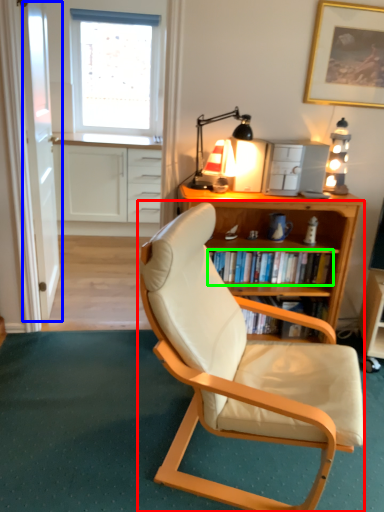
Question: Based on their relative distances, which object is farther from chair (highlighted by a red box)? Choose from glass door (highlighted by a blue box) and shelf (highlighted by a green box).

Choices:
 (A) glass door
 (B) shelf

Answer: (A)